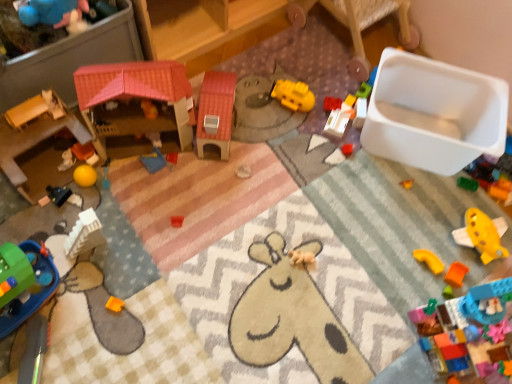
Identify the location of vacant space in between yellow plastic block at upper center, the fifth toy from the right, and translucent blue plastic blocks at lower right, the third toy viewed from the right. This screenshot has height=384, width=512. (405, 236).